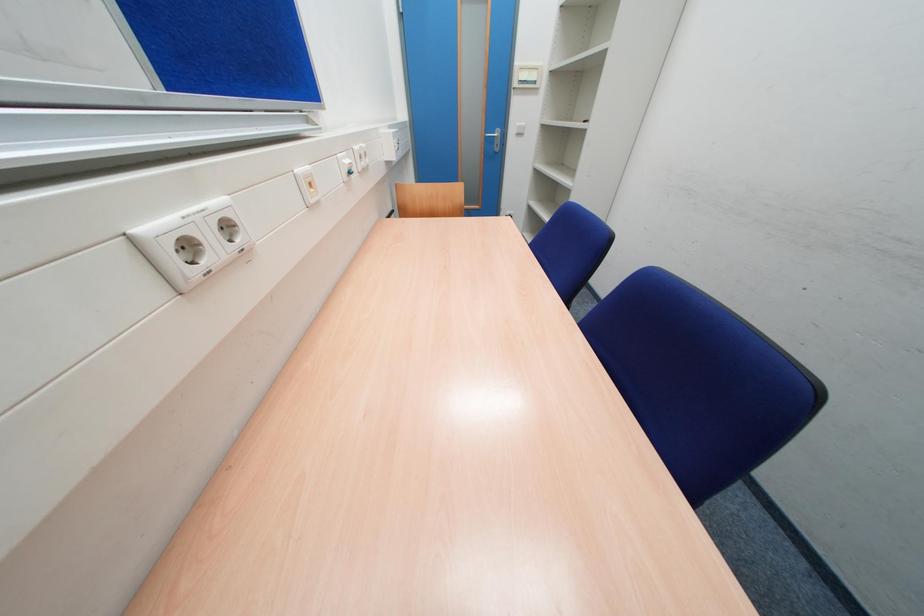
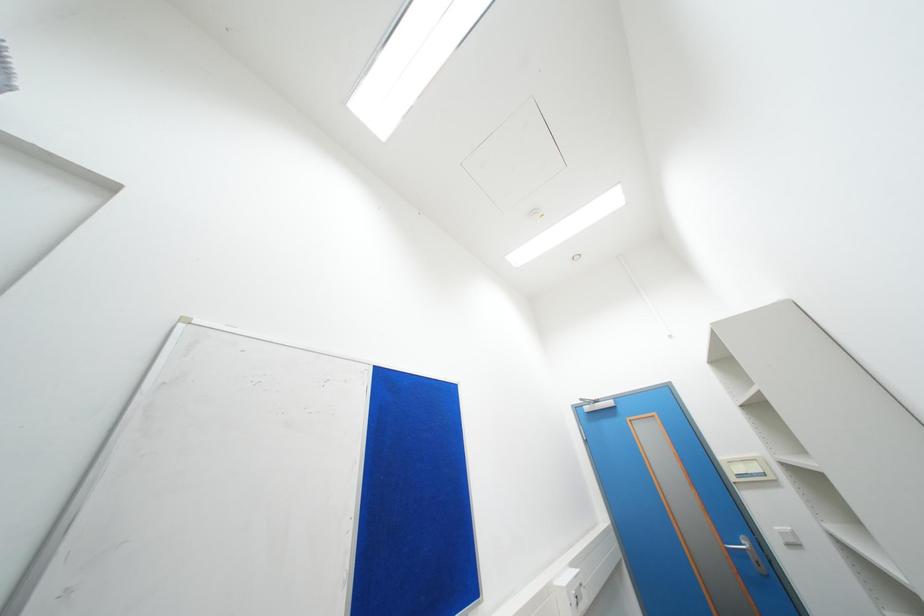
Based on the continuous images, in which direction is the camera rotating?

The camera rotated toward left-up.